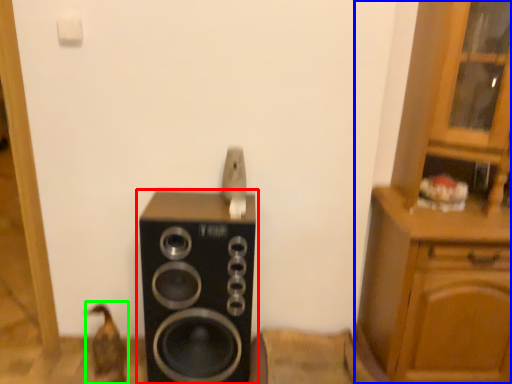
Question: Which object is positioned farthest from home appliance (highlighted by a red box)? Select from cabinetry (highlighted by a blue box) and animal (highlighted by a green box).

Choices:
 (A) cabinetry
 (B) animal

Answer: (A)